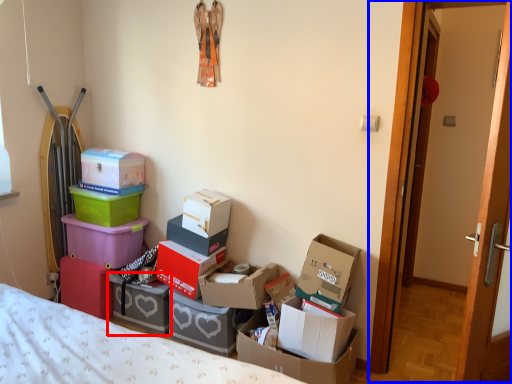
Question: Which object is further to the camera taking this photo, box (highlighted by a red box) or door (highlighted by a blue box)?

Choices:
 (A) box
 (B) door

Answer: (A)